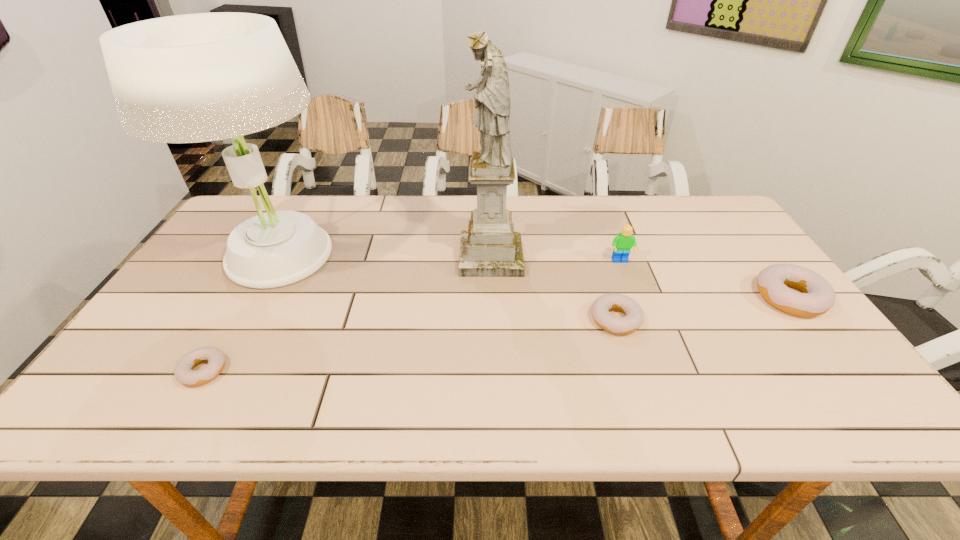
Where is `lamp present at the left edge`? Image resolution: width=960 pixels, height=540 pixels. lamp present at the left edge is located at coordinates pyautogui.click(x=191, y=78).

Identify the location of object that is at the right edge. (818, 296).

This screenshot has height=540, width=960. In order to click on object located in the far left corner section of the desktop in this screenshot , I will do `click(191, 78)`.

The image size is (960, 540). Identify the location of object that is at the near left corner. (184, 373).

In the image, there is a desktop. At what (x,y) coordinates should I click in order to perform the action: click on vacant region at the far edge. Please return your answer as a coordinate pair (x, y). The height and width of the screenshot is (540, 960). Looking at the image, I should click on (364, 215).

You are a GUI agent. You are given a task and a screenshot of the screen. Output one action in this format:
    pyautogui.click(x=<x>, y=<y>)
    Task: Click on the vacant region at the near edge of the desktop
    
    Given the screenshot: What is the action you would take?
    pyautogui.click(x=280, y=380)

The image size is (960, 540). In the image, there is a desktop. Find the location of `vacant region at the right edge`. vacant region at the right edge is located at coordinates (705, 253).

In the image, there is a desktop. Identify the location of vacant space at the far left corner. This screenshot has width=960, height=540. [x=243, y=201].

Image resolution: width=960 pixels, height=540 pixels. I want to click on free space between the lamp and the second doughnut from right to left, so click(446, 288).

Find the location of a particular element. The image size is (960, 540). empty space that is in between the second doughnut from right to left and the leftmost doughnut is located at coordinates (410, 345).